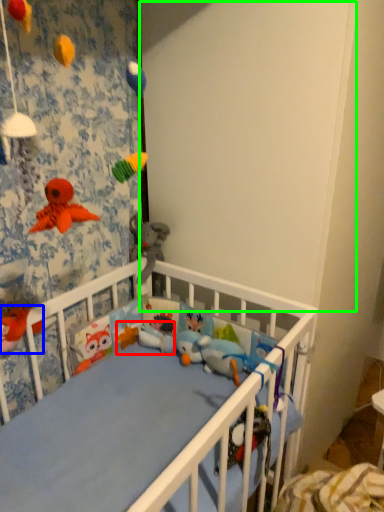
Question: Which object is positioned farthest from toy (highlighted by a red box)? Select from toy (highlighted by a blue box) and backdrop (highlighted by a green box).

Choices:
 (A) toy
 (B) backdrop

Answer: (B)